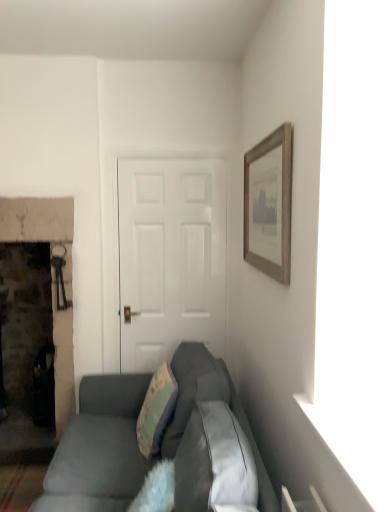
Question: Is teal fabric pillow at center not inside wooden framed print at upper right?

Choices:
 (A) no
 (B) yes

Answer: (B)

Question: Could wooden framed print at upper right be considered to be inside teal fabric pillow at center?

Choices:
 (A) no
 (B) yes

Answer: (A)

Question: Does teal fabric pillow at center touch wooden framed print at upper right?

Choices:
 (A) no
 (B) yes

Answer: (A)

Question: Is teal fabric pillow at center positioned with its back to wooden framed print at upper right?

Choices:
 (A) yes
 (B) no

Answer: (B)

Question: Considering the relative sizes of teal fabric pillow at center and wooden framed print at upper right in the image provided, is teal fabric pillow at center wider than wooden framed print at upper right?

Choices:
 (A) no
 (B) yes

Answer: (B)

Question: Is teal fabric pillow at center shorter than wooden framed print at upper right?

Choices:
 (A) no
 (B) yes

Answer: (B)

Question: Is black plastic trash can at left at the right side of teal fabric pillow at center?

Choices:
 (A) yes
 (B) no

Answer: (B)

Question: Is black plastic trash can at left completely or partially outside of teal fabric pillow at center?

Choices:
 (A) yes
 (B) no

Answer: (A)

Question: Is teal fabric pillow at center at the back of black plastic trash can at left?

Choices:
 (A) no
 (B) yes

Answer: (A)

Question: Is black plastic trash can at left placed right next to teal fabric pillow at center?

Choices:
 (A) yes
 (B) no

Answer: (B)

Question: From a real-world perspective, is black plastic trash can at left on teal fabric pillow at center?

Choices:
 (A) yes
 (B) no

Answer: (B)

Question: Can teal fabric pillow at center be found inside black plastic trash can at left?

Choices:
 (A) yes
 (B) no

Answer: (B)

Question: From the image's perspective, does black plastic trash can at left appear lower than wooden framed print at upper right?

Choices:
 (A) no
 (B) yes

Answer: (B)